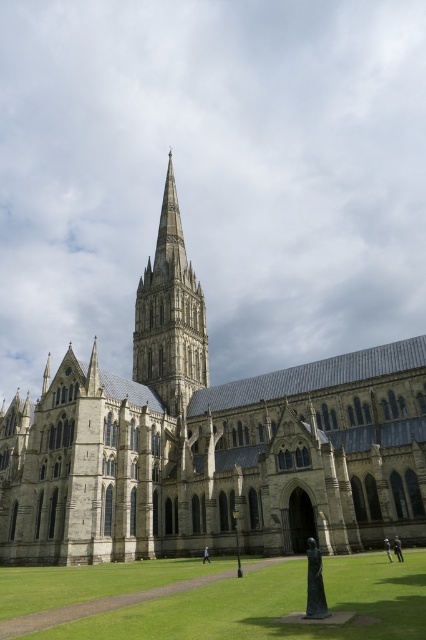
Question: Is gray stone church at center smaller than green grass at lower center?

Choices:
 (A) no
 (B) yes

Answer: (A)

Question: Does gray stone church at center have a larger size compared to stone spire at center?

Choices:
 (A) no
 (B) yes

Answer: (B)

Question: Which point appears farthest from the camera in this image?

Choices:
 (A) (203, 384)
 (B) (206, 470)

Answer: (A)

Question: Which object is closer to the camera taking this photo?

Choices:
 (A) stone spire at center
 (B) gray stone church at center
 (C) green grass at lower center

Answer: (C)

Question: Does gray stone church at center appear over green grass at lower center?

Choices:
 (A) no
 (B) yes

Answer: (B)

Question: Based on their relative distances, which object is nearer to the green grass at lower center?

Choices:
 (A) stone spire at center
 (B) gray stone church at center

Answer: (B)